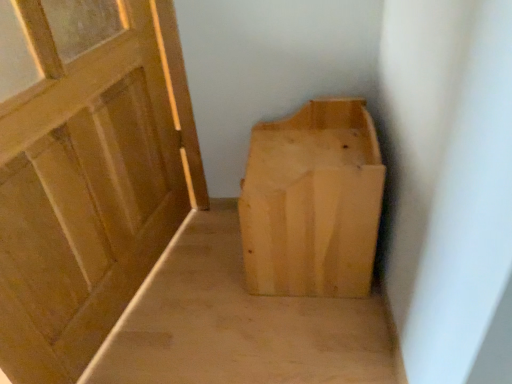
What do you see at coordinates (90, 180) in the screenshot? I see `matte wood door at left` at bounding box center [90, 180].

This screenshot has height=384, width=512. Describe the element at coordinates (239, 323) in the screenshot. I see `light wood bench at center` at that location.

In order to face light wood/rough textured box at center, should I rotate leftwards or rightwards?

You should look right and rotate roughly 7.365 degrees.

Locate an element on the screen. The image size is (512, 384). matte wood door at left is located at coordinates point(90,180).

In the scene shown: Is matte wood door at left positioned far away from light wood/rough textured box at center?

No.

Is matte wood door at left positioned behind light wood/rough textured box at center?

No, matte wood door at left is closer to the viewer.

Is point (106, 184) behind point (295, 251)?

That is False.

Looking at the image, does matte wood door at left seem bigger or smaller compared to light wood/rough textured box at center?

Considering their sizes, matte wood door at left takes up more space than light wood/rough textured box at center.

Between matte wood door at left and light wood bench at center, which one has smaller size?

light wood bench at center.

Is matte wood door at left taller than light wood bench at center?

Yes.

Is matte wood door at left closer to the viewer compared to light wood bench at center?

Yes, it is.

Consider the image. From a real-world perspective, is matte wood door at left on light wood bench at center?

Yes, from a real-world perspective, matte wood door at left is above light wood bench at center.

Between light wood/rough textured box at center and light wood bench at center, which one appears on the right side from the viewer's perspective?

light wood/rough textured box at center.

Considering the sizes of objects light wood/rough textured box at center and light wood bench at center in the image provided, who is taller, light wood/rough textured box at center or light wood bench at center?

Standing taller between the two is light wood/rough textured box at center.

From the image's perspective, which is above, light wood/rough textured box at center or light wood bench at center?

light wood/rough textured box at center appears higher in the image.

Is light wood bench at center at the back of light wood/rough textured box at center?

No.

Which point is more distant from viewer, [286,328] or [140,162]?

The point [140,162] is behind.

Is light wood bench at center wider than matte wood door at left?

Yes.

Could you tell me if light wood bench at center is turned towards matte wood door at left?

No, light wood bench at center is not facing towards matte wood door at left.

Is light wood bench at center not inside matte wood door at left?

light wood bench at center lies outside matte wood door at left's area.

From the image's perspective, is light wood/rough textured box at center beneath matte wood door at left?

Yes, from the image's perspective, light wood/rough textured box at center is below matte wood door at left.

Considering the relative sizes of light wood/rough textured box at center and matte wood door at left in the image provided, is light wood/rough textured box at center smaller than matte wood door at left?

Indeed, light wood/rough textured box at center has a smaller size compared to matte wood door at left.

Where is `furniture behind the matte wood door at left`? The image size is (512, 384). furniture behind the matte wood door at left is located at coordinates (312, 202).

Does light wood/rough textured box at center turn towards matte wood door at left?

Yes, light wood/rough textured box at center faces towards matte wood door at left.

Does point (131, 337) appear closer or farther from the camera than point (308, 119)?

Point (131, 337) is positioned closer to the camera compared to point (308, 119).

Is light wood bench at center completely or partially outside of light wood/rough textured box at center?

light wood bench at center is positioned outside light wood/rough textured box at center.

Is light wood bench at center far away from light wood/rough textured box at center?

light wood bench at center is actually quite close to light wood/rough textured box at center.

This screenshot has width=512, height=384. What are the coordinates of `furniture below the matte wood door at left (from the image's perspective)` in the screenshot? It's located at click(312, 202).

I want to click on plain on the right of matte wood door at left, so click(x=239, y=323).

Based on their spatial positions, is matte wood door at left or light wood/rough textured box at center closer to light wood bench at center?

light wood/rough textured box at center lies closer to light wood bench at center than the other object.

Considering their positions, is light wood bench at center positioned closer to light wood/rough textured box at center than matte wood door at left?

light wood bench at center lies closer to light wood/rough textured box at center than the other object.

Looking at the image, which one is located closer to light wood bench at center, light wood/rough textured box at center or matte wood door at left?

light wood/rough textured box at center is positioned closer to the anchor light wood bench at center.

Looking at the image, which one is located closer to matte wood door at left, light wood bench at center or light wood/rough textured box at center?

Among the two, light wood bench at center is located nearer to matte wood door at left.

Which object lies nearer to the anchor point light wood/rough textured box at center, matte wood door at left or light wood bench at center?

light wood bench at center is positioned closer to the anchor light wood/rough textured box at center.

Looking at the image, which one is located further to matte wood door at left, light wood/rough textured box at center or light wood bench at center?

light wood/rough textured box at center lies further to matte wood door at left than the other object.

The width and height of the screenshot is (512, 384). What are the coordinates of `furniture between matte wood door at left and light wood bench at center from front to back` in the screenshot? It's located at (312, 202).